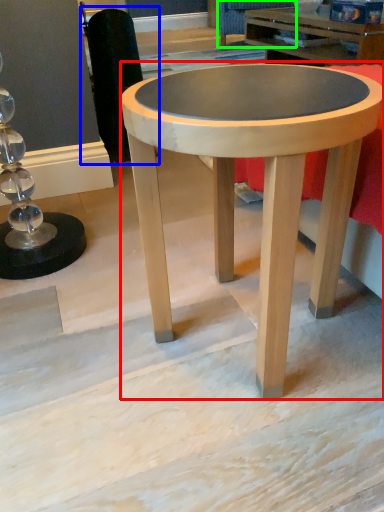
Question: Considering the real-world distances, which object is farthest from coffee table (highlighted by a red box)? swivel chair (highlighted by a blue box) or swivel chair (highlighted by a green box)?

Choices:
 (A) swivel chair
 (B) swivel chair

Answer: (B)